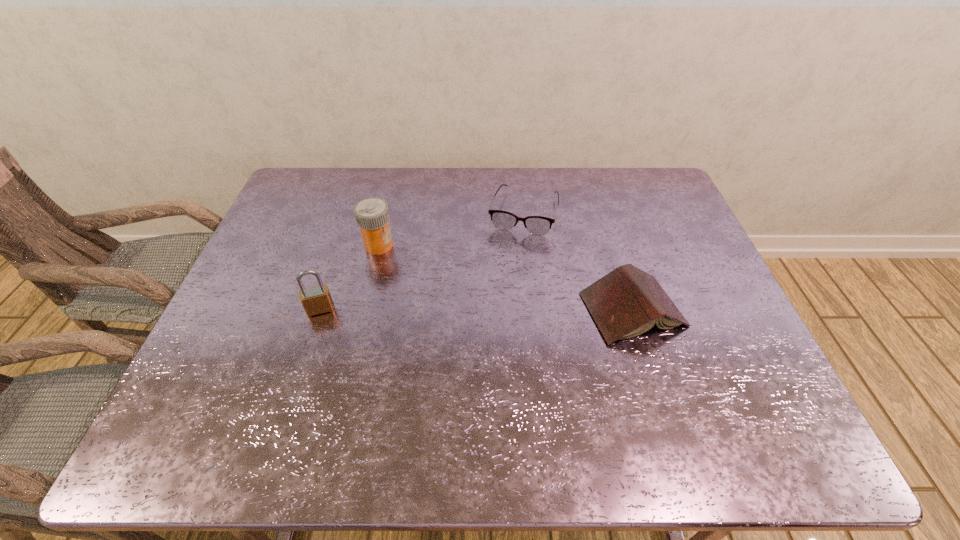
Locate an element on the screen. The height and width of the screenshot is (540, 960). free area in between the rightmost object and the leftmost object is located at coordinates (476, 309).

I want to click on vacant area that lies between the medicine and the rightmost object, so click(506, 278).

The width and height of the screenshot is (960, 540). What are the coordinates of `empty space that is in between the padlock and the third object from right to left` in the screenshot? It's located at (349, 277).

You are a GUI agent. You are given a task and a screenshot of the screen. Output one action in this format:
    pyautogui.click(x=<x>, y=<y>)
    Task: Click on the vacant area between the third object from left to right and the padlock
    This screenshot has width=960, height=540.
    Given the screenshot: What is the action you would take?
    pyautogui.click(x=421, y=261)

Locate an element on the screen. The height and width of the screenshot is (540, 960). vacant space that's between the padlock and the book is located at coordinates (476, 309).

Find the location of a particular element. unoccupied area between the rightmost object and the spectacles is located at coordinates (578, 261).

Find the location of `free spot between the leftmost object and the medicine`. free spot between the leftmost object and the medicine is located at coordinates (349, 277).

This screenshot has height=540, width=960. Identify the location of free space between the third object from right to left and the padlock. (349, 277).

The image size is (960, 540). What are the coordinates of `free space that is in between the medicine and the leftmost object` in the screenshot? It's located at (349, 277).

You are a GUI agent. You are given a task and a screenshot of the screen. Output one action in this format:
    pyautogui.click(x=<x>, y=<y>)
    Task: Click on the object that is the third closest to the rightmost object
    Image resolution: width=960 pixels, height=540 pixels.
    Given the screenshot: What is the action you would take?
    (x=315, y=300)